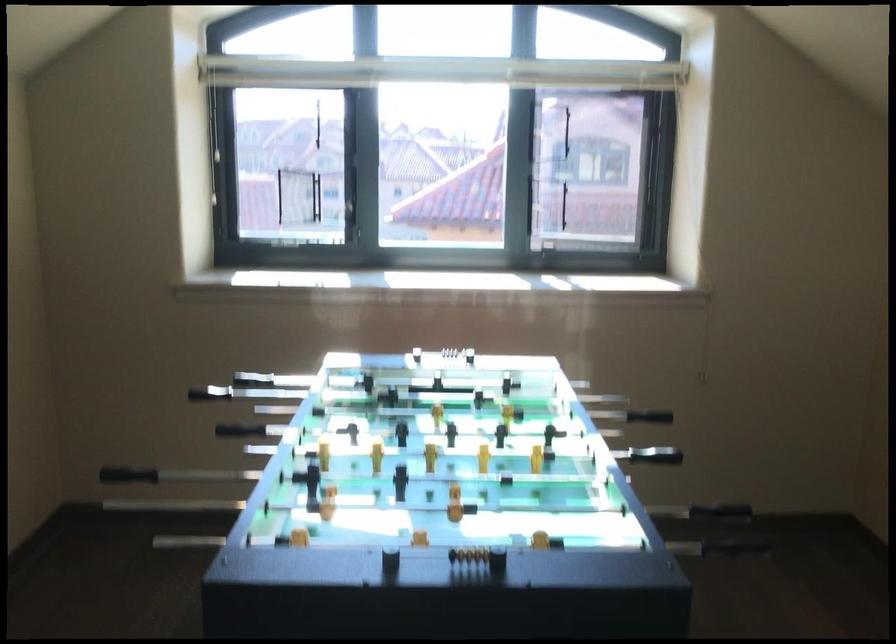
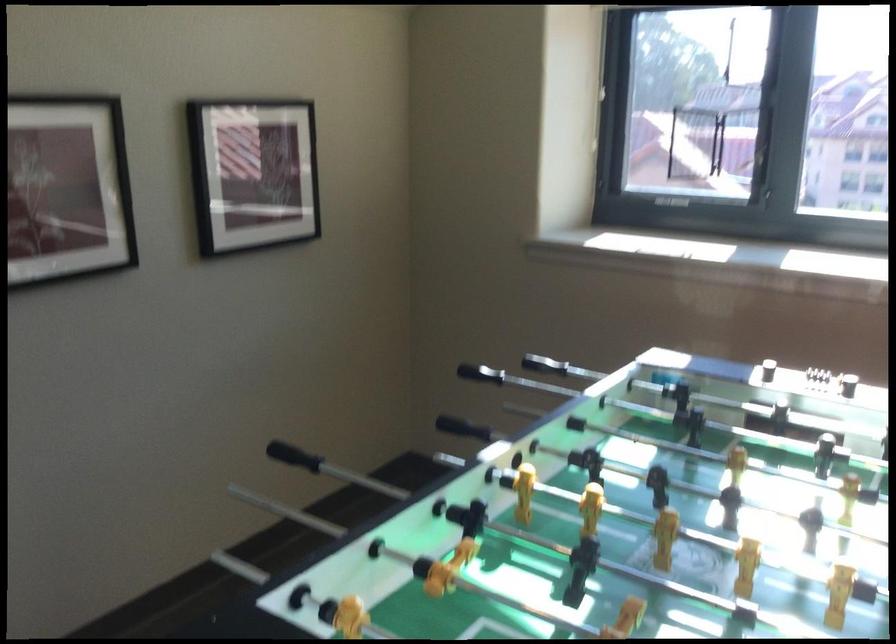
Locate, in the second image, the point that corresponds to (x=135, y=404) in the first image.

(479, 373)